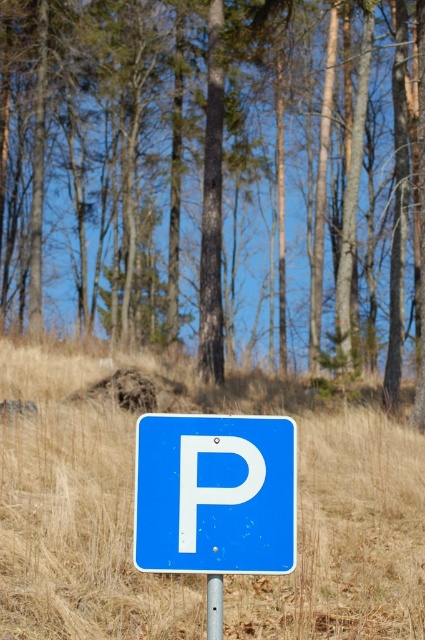
Question: Which point is farther from the camera taking this photo?

Choices:
 (A) tap(31, 52)
 (B) tap(73, 534)

Answer: (A)

Question: Estimate the real-world distances between objects in this image. Which object is closer to the metallic pole at center?

Choices:
 (A) brown bark tree at center
 (B) dry grass at center

Answer: (B)

Question: Does dry grass at center have a smaller size compared to white matte letter p at center?

Choices:
 (A) no
 (B) yes

Answer: (A)

Question: Observing the image, what is the correct spatial positioning of brown bark tree at center in reference to white matte letter p at center?

Choices:
 (A) below
 (B) above

Answer: (B)

Question: Does dry grass at center appear over white matte letter p at center?

Choices:
 (A) no
 (B) yes

Answer: (A)

Question: Among these objects, which one is nearest to the camera?

Choices:
 (A) white matte letter p at center
 (B) brown bark tree at center
 (C) dry grass at center

Answer: (A)